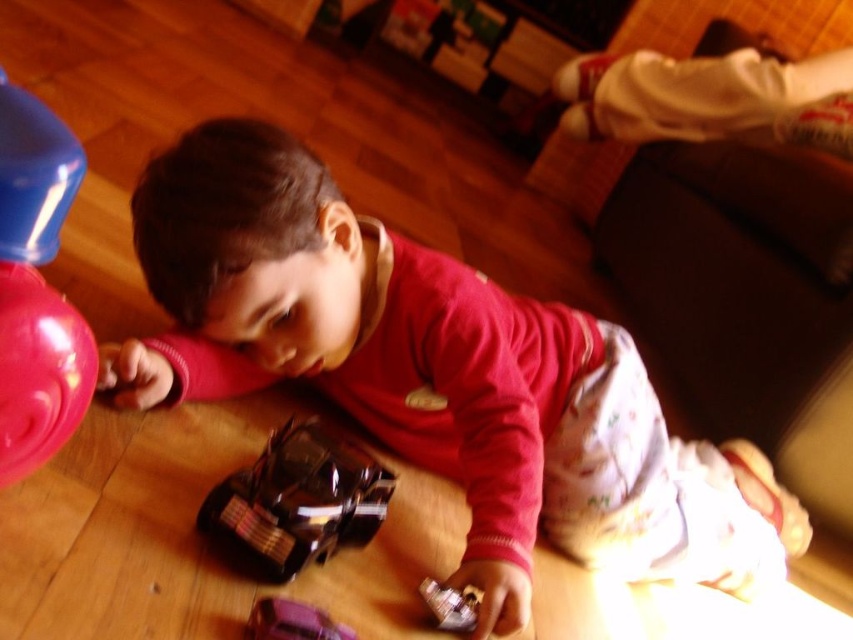
Question: Is shiny black car at lower left to the right of metallic purple car at lower center from the viewer's perspective?

Choices:
 (A) no
 (B) yes

Answer: (A)

Question: Which object appears closest to the camera in this image?

Choices:
 (A) rubberized pink ball at left
 (B) matte red shirt at center

Answer: (A)

Question: Can you confirm if rubberized pink ball at left is positioned to the right of metallic purple car at lower center?

Choices:
 (A) no
 (B) yes

Answer: (A)

Question: Which point is farther to the camera?

Choices:
 (A) matte red shirt at center
 (B) rubberized pink ball at left
 (C) metallic purple car at lower center
 (D) shiny black car at lower left

Answer: (A)

Question: Which point appears closest to the camera in this image?

Choices:
 (A) (13, 465)
 (B) (293, 634)
 (C) (155, 227)

Answer: (A)

Question: Is matte red shirt at center below metallic purple car at lower center?

Choices:
 (A) no
 (B) yes

Answer: (A)